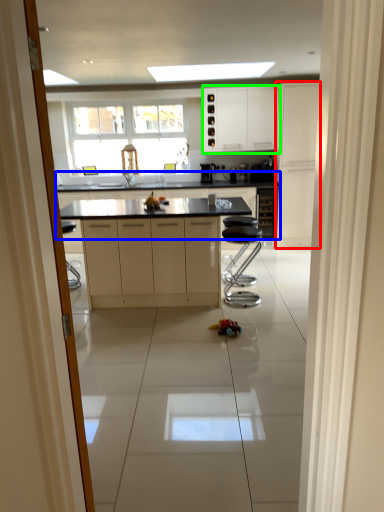
Question: Based on their relative distances, which object is farther from cabinetry (highlighted by a red box)? Choose from countertop (highlighted by a blue box) and cabinetry (highlighted by a green box).

Choices:
 (A) countertop
 (B) cabinetry

Answer: (A)